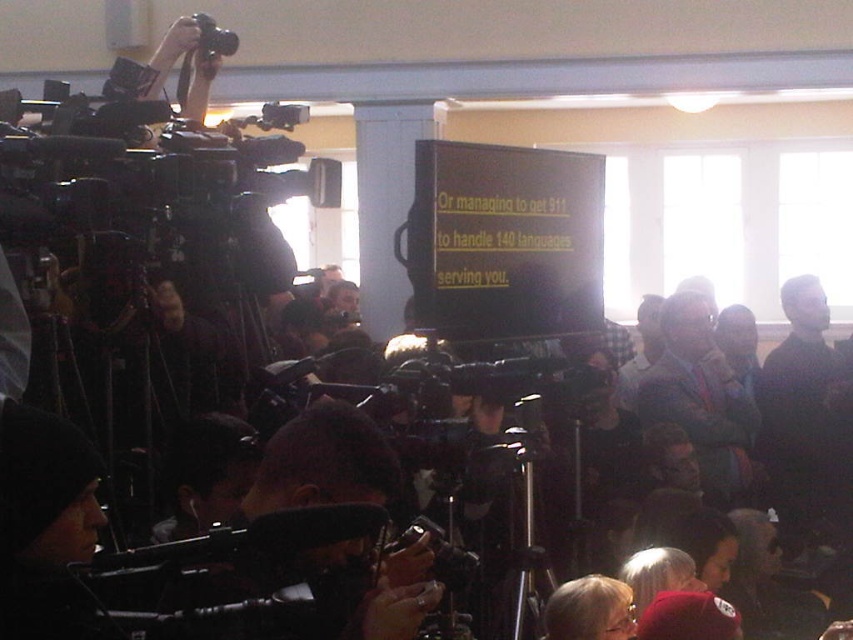
Question: Among these points, which one is farthest from the camera?

Choices:
 (A) (688, 310)
 (B) (612, 618)
 (C) (213, 54)

Answer: (A)

Question: Estimate the real-world distances between objects in this image. Which object is closer to the blue fabric suit at center?

Choices:
 (A) black plastic video camera at upper left
 (B) blonde hair at lower center

Answer: (B)

Question: Does blue fabric suit at center have a greater width compared to blonde hair at lower center?

Choices:
 (A) yes
 (B) no

Answer: (A)

Question: Which of the following is the closest to the observer?

Choices:
 (A) black plastic video camera at upper left
 (B) blonde hair at lower center

Answer: (B)

Question: Can you confirm if blue fabric suit at center is smaller than black plastic video camera at upper left?

Choices:
 (A) yes
 (B) no

Answer: (B)

Question: Is blonde hair at lower center thinner than black plastic video camera at upper left?

Choices:
 (A) yes
 (B) no

Answer: (B)